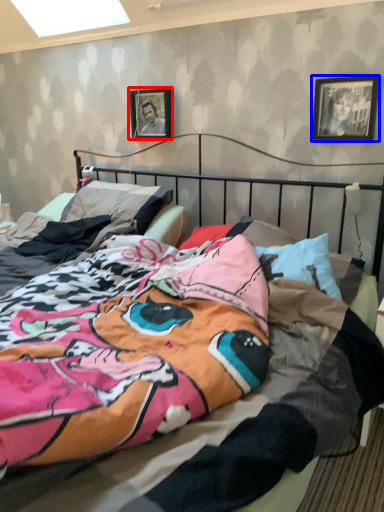
Question: Which object is closer to the camera taking this photo, picture frame (highlighted by a red box) or picture frame (highlighted by a blue box)?

Choices:
 (A) picture frame
 (B) picture frame

Answer: (B)